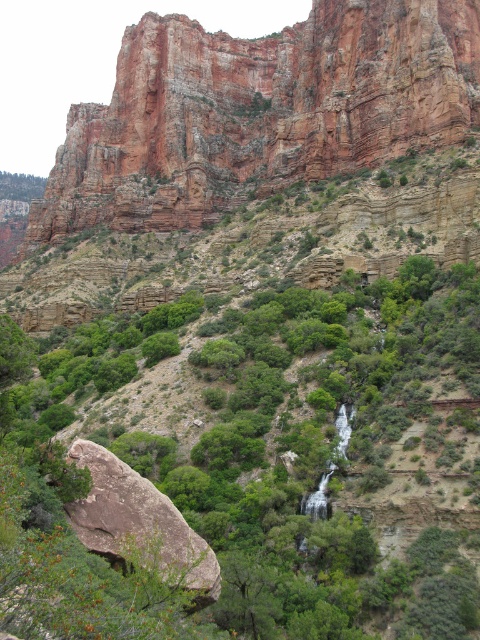
You are a hiker planning to cross the area between the rustic rock cliff at upper center and the brown rough rock at lower left. Based on their widths, which rock feature would allow you to stand on it more comfortably?

The rustic rock cliff at upper center might be wider than the brown rough rock at lower left, so it would likely provide a more stable and comfortable surface for standing.

You are standing at the base of the red rock formation and want to reach a hidden spring located at one of the two points. The spring is either at point (463,1) or point (177,556). Which point is closer to you?

Point (463,1) is closer to you because it is further to the viewer than point (177,556), meaning it is physically nearer in the landscape.

You are a hiker who wants to take a photo of the brown rough rock at lower left without the green leafy tree at center blocking the view. Is it possible to do so from your current position?

The green leafy tree at center is bigger than the brown rough rock at lower left, so it might block the view. To avoid the tree blocking, move to a position where the tree is not between you and the rock, perhaps to the side or behind the rock.